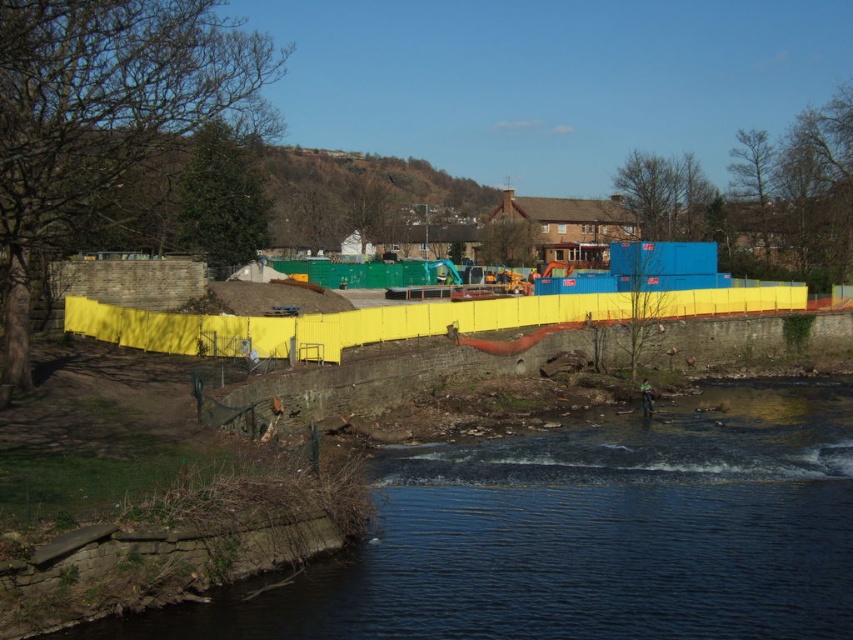
Who is higher up, dark blue water at lower center or yellow plastic barrier at center?

yellow plastic barrier at center is higher up.

Which is more to the right, dark blue water at lower center or yellow plastic barrier at center?

yellow plastic barrier at center is more to the right.

Locate an element on the screen. dark blue water at lower center is located at coordinates (584, 534).

Locate an element on the screen. This screenshot has width=853, height=640. dark blue water at lower center is located at coordinates (584, 534).